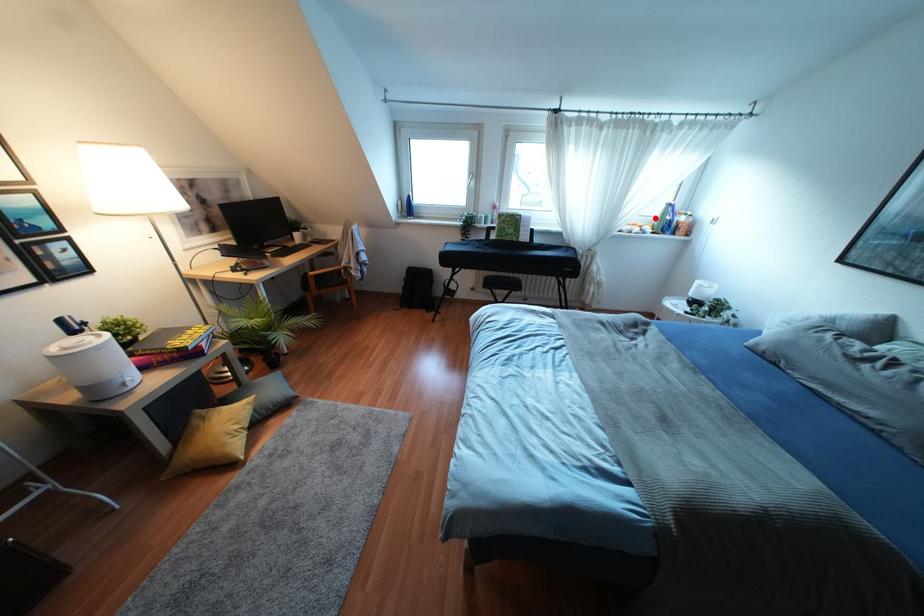
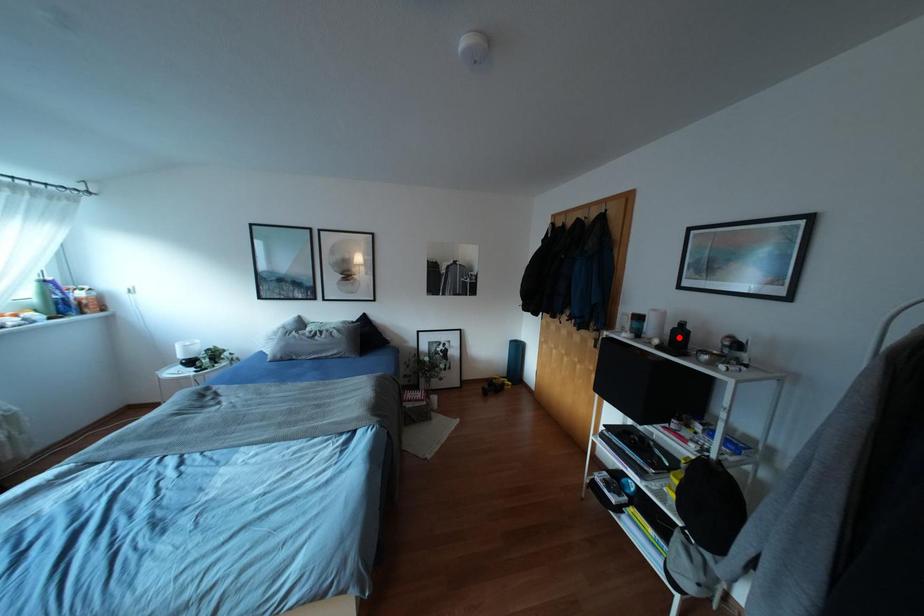
I am providing you with two images of the same scene from different viewpoints. A red point is marked on the first image and another point is marked on the second image. Do the highlighted points in image1 and image2 indicate the same real-world spot?

No